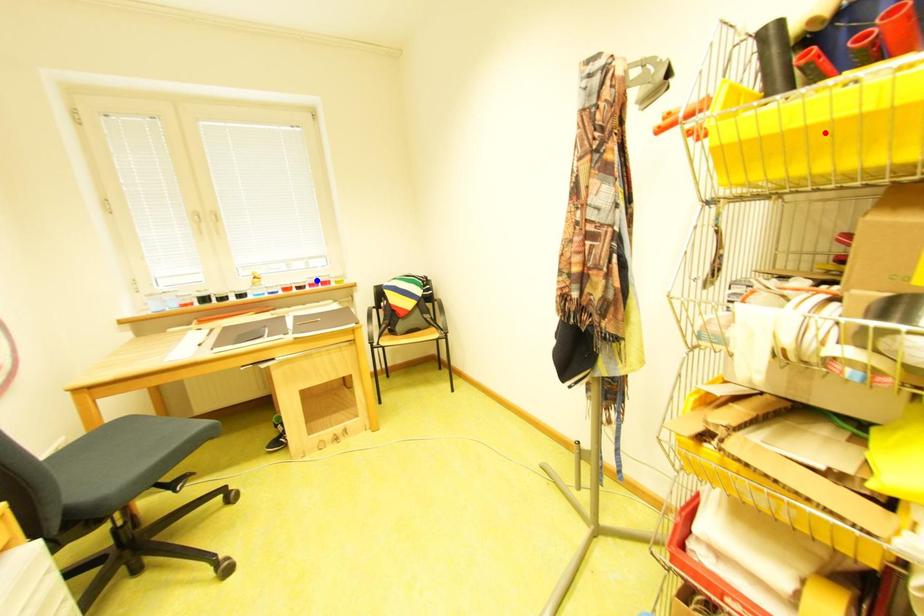
Question: Two points are marked on the image. Which point is closer to the camera?

Choices:
 (A) Blue point is closer.
 (B) Red point is closer.

Answer: (B)